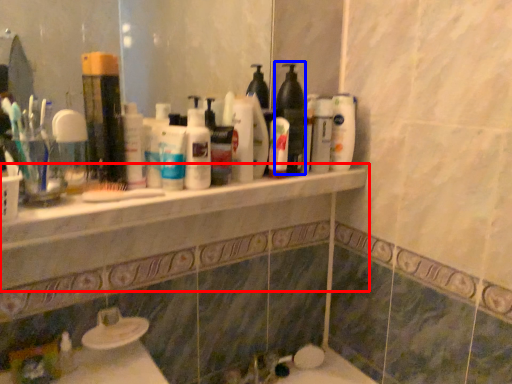
Question: Which point is closer to the camera, counter top (highlighted by a red box) or cleaning product (highlighted by a blue box)?

Choices:
 (A) counter top
 (B) cleaning product

Answer: (A)